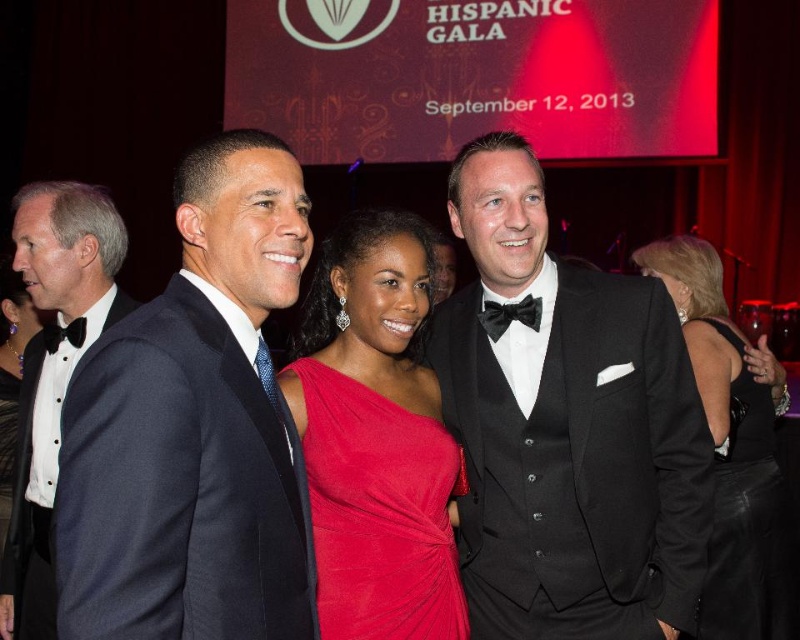
You are a photographer at the Hispanic Gala and need to capture a closeup of the matte black tuxedo at left and the black satin bow tie at right. Which one should you focus on first to ensure it appears sharp in the photo?

The matte black tuxedo at left is closer to the viewer than the black satin bow tie at right, so you should focus on the matte black tuxedo at left first to ensure it appears sharp in the photo.

You are a photographer at the Hispanic Gala. You notice the velvet black dress at center and the matte black bow tie at left. Which one is positioned lower in the image?

The velvet black dress at center is located below the matte black bow tie at left, so the velvet black dress at center is positioned lower.

You are a photographer at the Hispanic Gala and need to adjust the lighting to ensure both the matte black tuxedo at left and the black satin bow tie at right are visible. Considering their height difference, which object should you focus on first to ensure proper exposure?

The matte black tuxedo at left is taller than the black satin bow tie at right, so focusing on the matte black tuxedo at left first will ensure proper exposure for the taller object before adjusting for the shorter one.